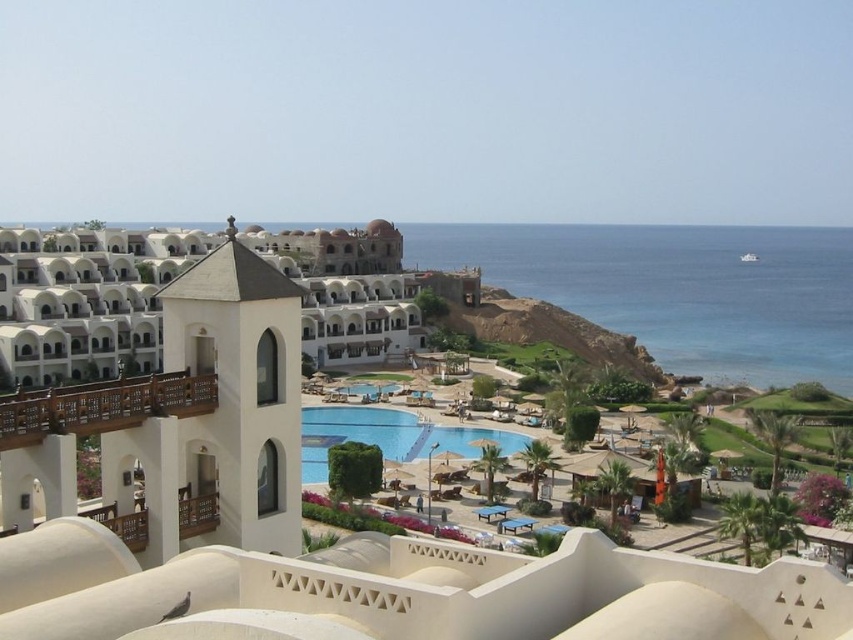
Question: Among these objects, which one is farthest from the camera?

Choices:
 (A) blue glossy pool at center
 (B) wooden balcony at upper left
 (C) white matte building at center

Answer: (A)

Question: Which point is closer to the camera?

Choices:
 (A) white matte building at center
 (B) wooden balcony at upper left

Answer: (A)

Question: Does white matte building at center have a larger size compared to blue glossy pool at center?

Choices:
 (A) yes
 (B) no

Answer: (A)

Question: Which object is farther from the camera taking this photo?

Choices:
 (A) wooden balcony at upper left
 (B) blue glossy pool at center

Answer: (B)

Question: Is white matte building at center to the right of wooden balcony at upper left from the viewer's perspective?

Choices:
 (A) yes
 (B) no

Answer: (A)

Question: Can you confirm if white matte building at center is positioned above blue glossy pool at center?

Choices:
 (A) yes
 (B) no

Answer: (A)